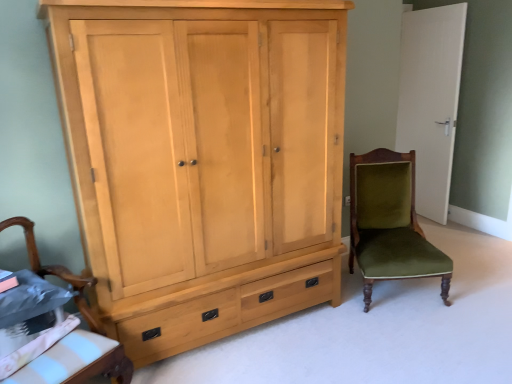
What are the coordinates of `vacant space to the right of light wood wardrobe at left` in the screenshot? It's located at (385, 338).